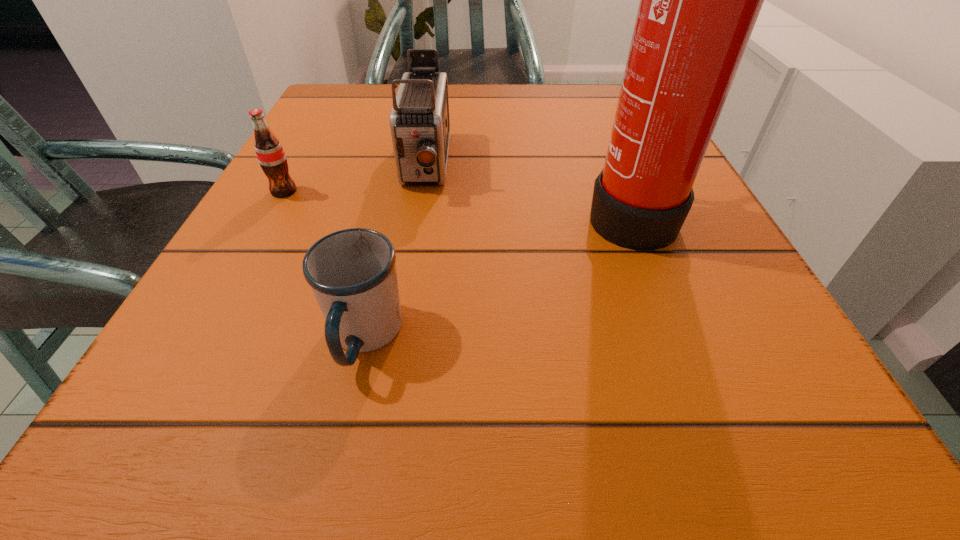
Find the location of a particular element. The width and height of the screenshot is (960, 540). fire extinguisher is located at coordinates (x=699, y=0).

You are a GUI agent. You are given a task and a screenshot of the screen. Output one action in this format:
    pyautogui.click(x=<x>, y=<y>)
    Task: Click on the rightmost object
    This screenshot has height=540, width=960.
    Given the screenshot: What is the action you would take?
    pyautogui.click(x=699, y=0)

This screenshot has width=960, height=540. In order to click on the second tallest object in this screenshot , I will do `click(419, 121)`.

Identify the location of the second shortest object. This screenshot has width=960, height=540. (270, 154).

I want to click on soda, so click(x=270, y=154).

Locate an element on the screen. This screenshot has height=540, width=960. the shortest object is located at coordinates (352, 273).

In order to click on the nearest object in this screenshot , I will do `click(352, 273)`.

The height and width of the screenshot is (540, 960). Identify the location of vacant region located 0.050m on the front-facing side of the fire extinguisher. (553, 212).

This screenshot has width=960, height=540. In order to click on vacant space situated 0.300m on the front-facing side of the fire extinguisher in this screenshot , I will do pyautogui.click(x=392, y=212).

Where is `vacant space located 0.240m on the front-facing side of the fire extinguisher`? vacant space located 0.240m on the front-facing side of the fire extinguisher is located at coordinates (430, 212).